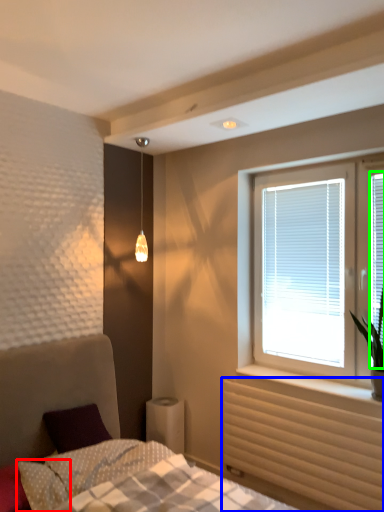
Question: Based on their relative distances, which object is farther from pillow (highlighted by a red box)? Choose from radiator (highlighted by a blue box) and window screen (highlighted by a green box).

Choices:
 (A) radiator
 (B) window screen

Answer: (B)